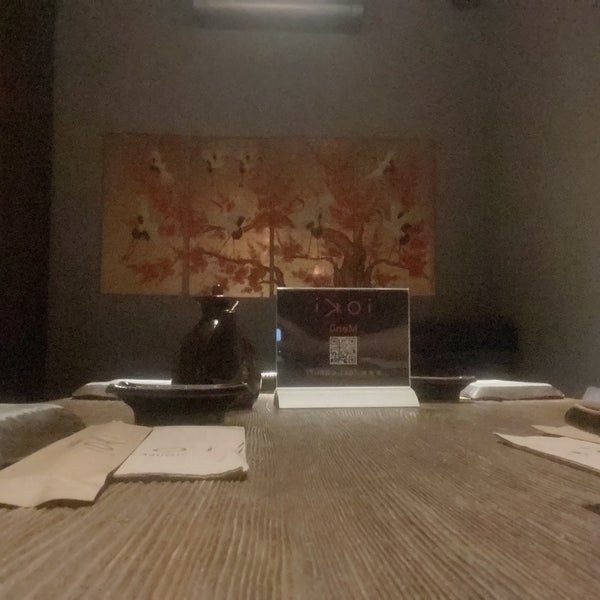
Identify the location of ac wall unit. click(x=279, y=18).